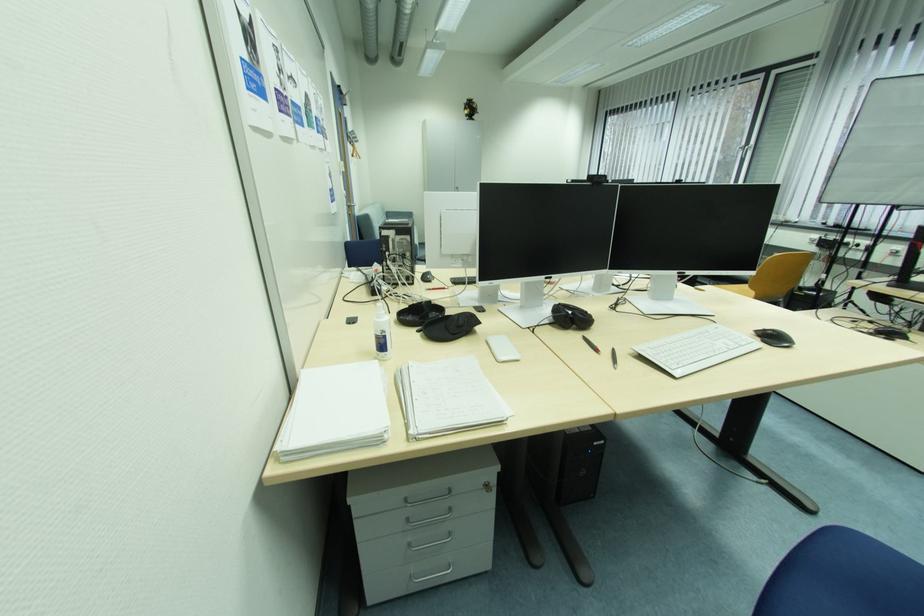
The location [597,179] corresponds to which object?

This point indicates the black webcam.